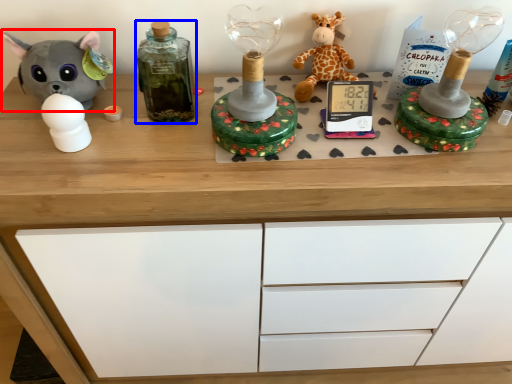
Question: Which object appears closest to the camera in this image, toy (highlighted by a red box) or bottle (highlighted by a blue box)?

Choices:
 (A) toy
 (B) bottle

Answer: (B)